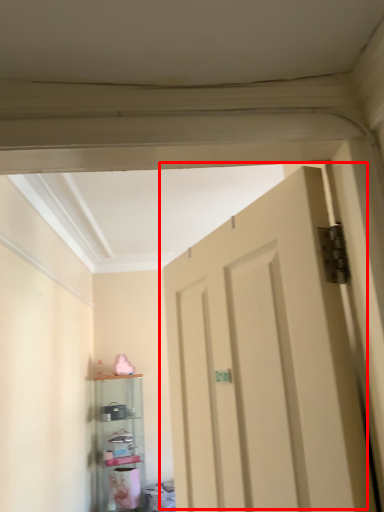
Question: Considering the relative positions of door (annotated by the red box) and shelf in the image provided, where is door (annotated by the red box) located with respect to the staircase?

Choices:
 (A) right
 (B) left

Answer: (A)